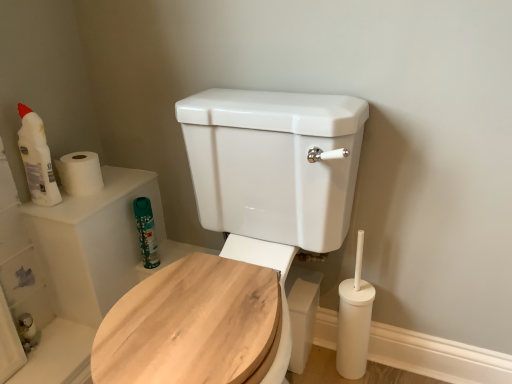
Question: From a real-world perspective, is wooden toilet seat at center physically located above or below matte white bottle at upper left, placed as the 1th cleaning product when sorted from left to right?

Choices:
 (A) above
 (B) below

Answer: (B)

Question: Looking at the image, does wooden toilet seat at center seem bigger or smaller compared to matte white bottle at upper left, which is counted as the second cleaning product, starting from the bottom?

Choices:
 (A) big
 (B) small

Answer: (A)

Question: Which object is the closest to the matte white bottle at upper left, the 2th cleaning product when ordered from back to front?

Choices:
 (A) wooden toilet seat at center
 (B) green matte canister at upper left, the 2th cleaning product in the top-to-bottom sequence
 (C) white matte toilet paper at upper left

Answer: (C)

Question: Based on their relative distances, which object is nearer to the white matte toilet paper at upper left?

Choices:
 (A) green matte canister at upper left, arranged as the 1th cleaning product when viewed from the back
 (B) wooden toilet seat at center
 (C) matte white bottle at upper left, the 2th cleaning product when ordered from back to front

Answer: (C)